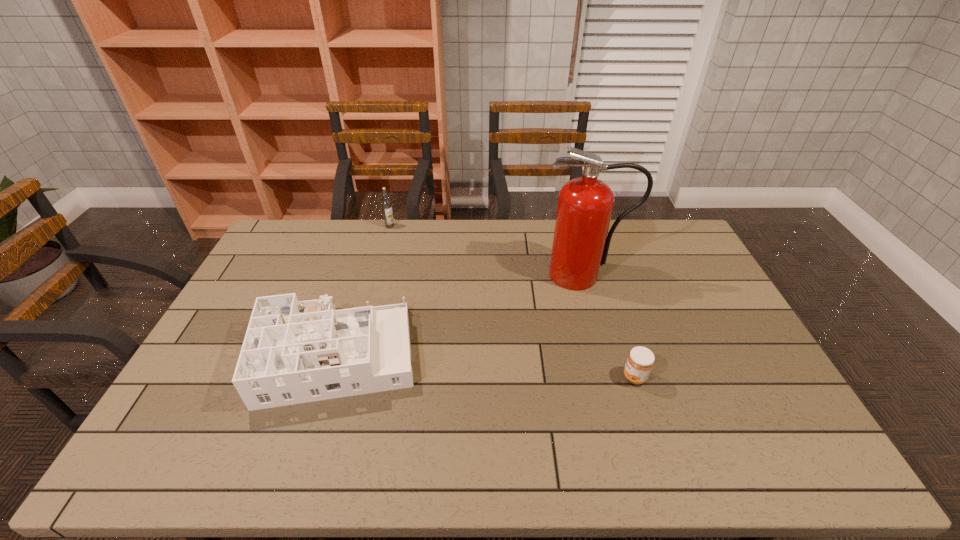
In order to click on free region located on the front label of the jam in this screenshot , I will do `click(575, 377)`.

Locate an element on the screen. The image size is (960, 540). vacant space located on the front label of the jam is located at coordinates (506, 377).

Locate an element on the screen. object situated at the far edge is located at coordinates (386, 203).

Where is `object that is at the left edge`? Image resolution: width=960 pixels, height=540 pixels. object that is at the left edge is located at coordinates [294, 352].

Where is `vacant point at the far edge`? This screenshot has height=540, width=960. vacant point at the far edge is located at coordinates (545, 234).

You are a GUI agent. You are given a task and a screenshot of the screen. Output one action in this format:
    pyautogui.click(x=<x>, y=<y>)
    Task: Click on the vacant space at the near edge
    
    Given the screenshot: What is the action you would take?
    pyautogui.click(x=734, y=455)

Where is `free space at the right edge of the desktop`? The image size is (960, 540). free space at the right edge of the desktop is located at coordinates (778, 417).

Where is `vacant space at the far left corner of the desktop`? The width and height of the screenshot is (960, 540). vacant space at the far left corner of the desktop is located at coordinates (297, 234).

You are a GUI agent. You are given a task and a screenshot of the screen. Output one action in this format:
    pyautogui.click(x=<x>, y=<y>)
    Task: Click on the free region at the near left corner of the desktop
    
    Given the screenshot: What is the action you would take?
    pyautogui.click(x=195, y=445)

Locate an element on the screen. This screenshot has height=540, width=960. vacant space that's between the second tallest object and the tallest object is located at coordinates (487, 251).